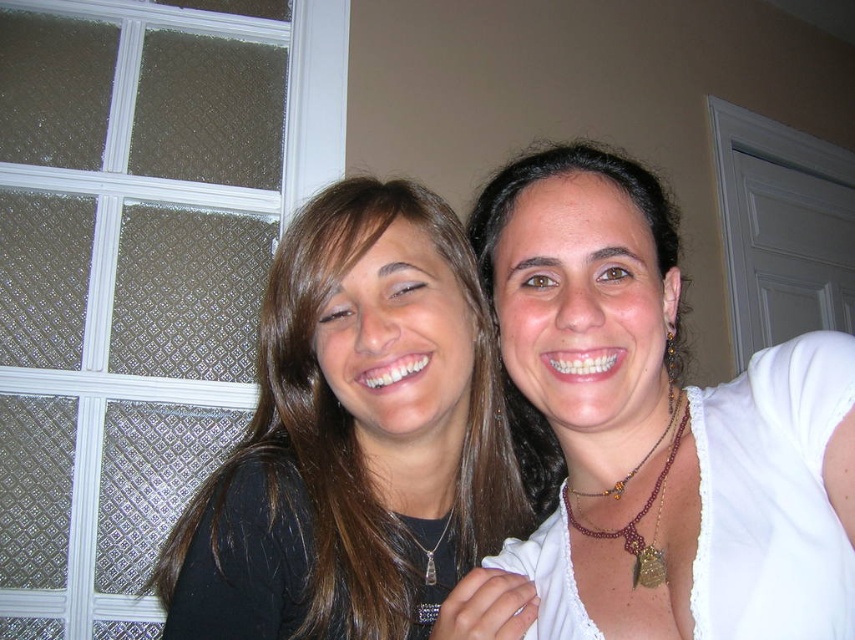
Question: Which object is positioned farthest from the beaded burgundy necklace at upper right?

Choices:
 (A) white matte necklace at upper right
 (B) matte black shirt at center

Answer: (B)

Question: Does white matte necklace at upper right come behind silver/glass pendant at center?

Choices:
 (A) yes
 (B) no

Answer: (B)

Question: Which point appears closest to the camera in this image?

Choices:
 (A) [x=417, y=545]
 (B) [x=570, y=522]
 (C) [x=575, y=632]

Answer: (C)

Question: Considering the real-world distances, which object is closest to the beaded burgundy necklace at upper right?

Choices:
 (A) silver/glass pendant at center
 (B) matte black shirt at center

Answer: (A)

Question: From the image, what is the correct spatial relationship of beaded burgundy necklace at upper right in relation to silver/glass pendant at center?

Choices:
 (A) right
 (B) left

Answer: (A)

Question: Can you confirm if white matte necklace at upper right is positioned below matte black shirt at center?

Choices:
 (A) no
 (B) yes

Answer: (A)